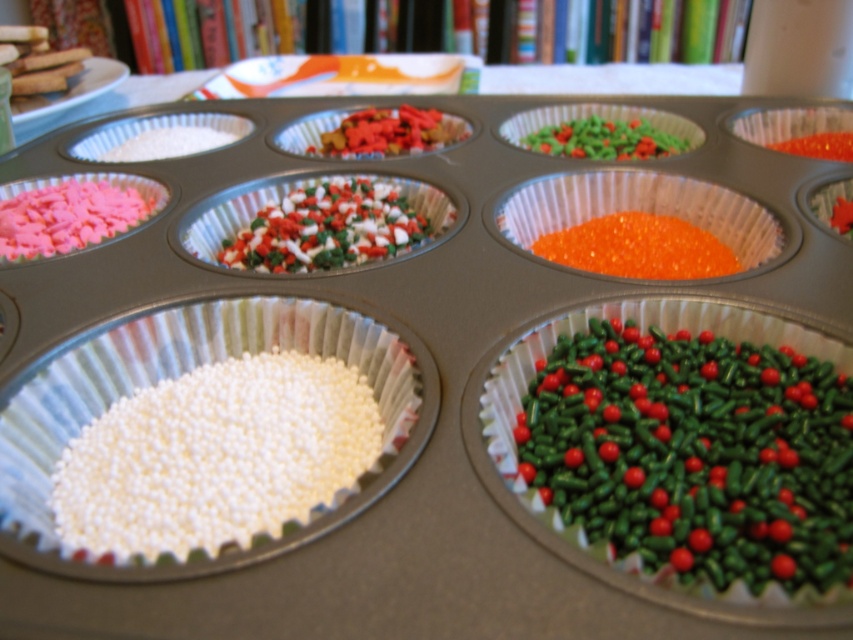
Question: Does green glossy sprinkles at center appear over white matte sprinkles at center left?

Choices:
 (A) yes
 (B) no

Answer: (A)

Question: Which is farther from the multicolored sprinkles at center?

Choices:
 (A) orange glossy sprinkles at center
 (B) orange glossy beads at center
 (C) green glossy sprinkles at center
 (D) white matte sprinkles at center left

Answer: (C)

Question: Which of these objects is positioned closest to the orange glossy sprinkles at center?

Choices:
 (A) multicolored sprinkles at center
 (B) white matte sprinkles at center left
 (C) green glossy sprinkles at center

Answer: (C)

Question: Where is orange glossy beads at center located in relation to orange glossy sprinkles at center in the image?

Choices:
 (A) below
 (B) above

Answer: (B)

Question: Where is multicolored sprinkles at center located in relation to orange glossy beads at center in the image?

Choices:
 (A) below
 (B) above

Answer: (B)

Question: Which point is farther to the camera?

Choices:
 (A) orange glossy sprinkles at center
 (B) multicolored sprinkles at center

Answer: (B)